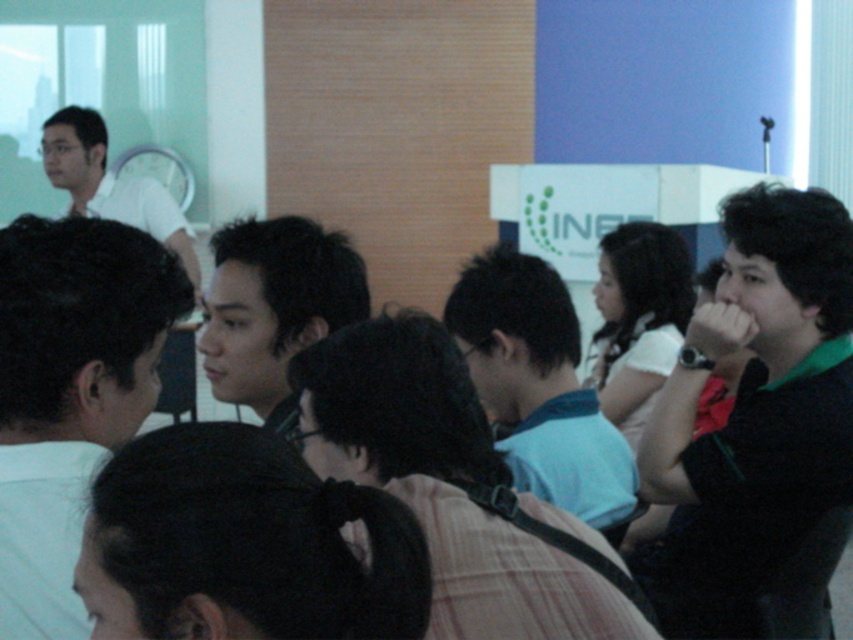
Is blue cotton shirt at center smaller than white matte shirt at upper left?

Correct, blue cotton shirt at center occupies less space than white matte shirt at upper left.

Where is `blue cotton shirt at center`? This screenshot has height=640, width=853. blue cotton shirt at center is located at coordinates point(540,388).

At what (x,y) coordinates should I click in order to perform the action: click on blue cotton shirt at center. Please return your answer as a coordinate pair (x, y). Image resolution: width=853 pixels, height=640 pixels. Looking at the image, I should click on (540, 388).

Is dark brown hair at left taller than smooth black hair at center?

Indeed, dark brown hair at left has a greater height compared to smooth black hair at center.

Does dark brown hair at left lie behind smooth black hair at center?

That is False.

Is point (21, 355) in front of point (276, 348)?

Yes, it is in front of point (276, 348).

Identify the location of dark brown hair at left. The height and width of the screenshot is (640, 853). (68, 394).

Is the position of dark brown hair at left more distant than that of blue cotton shirt at center?

No, it is not.

Can you confirm if dark brown hair at left is bigger than blue cotton shirt at center?

Incorrect, dark brown hair at left is not larger than blue cotton shirt at center.

Does point (91, 342) come behind point (543, 456)?

No, it is in front of (543, 456).

The image size is (853, 640). What are the coordinates of `dark brown hair at left` in the screenshot? It's located at (68, 394).